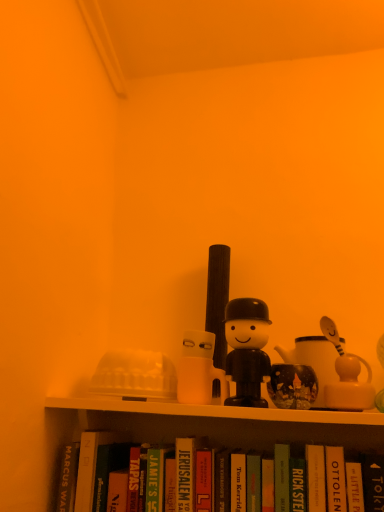
Question: Which direction should I rotate to look at translucent glass mug at center, which ranks as the 2th toy in right-to-left order?

Choices:
 (A) right
 (B) left

Answer: (A)

Question: Which direction should I rotate to look at hardcover book at center, the 7th paperback book positioned from the left, — up or down?

Choices:
 (A) up
 (B) down

Answer: (B)

Question: Is green matte book at lower center, the first paperback book from the left, bigger than hardcover book at center, placed as the third paperback book when sorted from left to right?

Choices:
 (A) no
 (B) yes

Answer: (A)

Question: Does green matte book at lower center, marked as the 7th paperback book in a right-to-left arrangement, turn towards hardcover book at center, acting as the fifth paperback book starting from the right?

Choices:
 (A) no
 (B) yes

Answer: (A)

Question: Is green matte book at lower center, marked as the 7th paperback book in a right-to-left arrangement, not within hardcover book at center, acting as the fifth paperback book starting from the right?

Choices:
 (A) yes
 (B) no

Answer: (A)

Question: Is green matte book at lower center, marked as the 7th paperback book in a right-to-left arrangement, further to the viewer compared to hardcover book at center, placed as the third paperback book when sorted from left to right?

Choices:
 (A) yes
 (B) no

Answer: (A)

Question: Is green matte book at lower center, the first paperback book from the left, positioned far away from hardcover book at center, placed as the third paperback book when sorted from left to right?

Choices:
 (A) yes
 (B) no

Answer: (B)

Question: Is green matte book at lower center, marked as the 7th paperback book in a right-to-left arrangement, at the left side of hardcover book at center, acting as the fifth paperback book starting from the right?

Choices:
 (A) yes
 (B) no

Answer: (A)

Question: From a real-world perspective, is hardcover book at center, arranged as the sixth paperback book when viewed from the right, over hardcover book at center, the 5th paperback book viewed from the left?

Choices:
 (A) no
 (B) yes

Answer: (A)

Question: Is hardcover book at center, arranged as the sixth paperback book when viewed from the right, outside hardcover book at center, the 3th paperback book positioned from the right?

Choices:
 (A) no
 (B) yes

Answer: (B)

Question: Is hardcover book at center, which appears as the 2th paperback book when viewed from the left, oriented away from hardcover book at center, the 5th paperback book viewed from the left?

Choices:
 (A) yes
 (B) no

Answer: (B)

Question: Considering the relative sizes of hardcover book at center, arranged as the sixth paperback book when viewed from the right, and hardcover book at center, the 5th paperback book viewed from the left, in the image provided, is hardcover book at center, arranged as the sixth paperback book when viewed from the right, smaller than hardcover book at center, the 5th paperback book viewed from the left,?

Choices:
 (A) no
 (B) yes

Answer: (A)

Question: Is hardcover book at center, which appears as the 2th paperback book when viewed from the left, at the right side of hardcover book at center, the 5th paperback book viewed from the left?

Choices:
 (A) no
 (B) yes

Answer: (A)

Question: Is hardcover book at center, which appears as the 2th paperback book when viewed from the left, facing towards hardcover book at center, the 3th paperback book positioned from the right?

Choices:
 (A) no
 (B) yes

Answer: (A)

Question: Can you confirm if green matte paperback book at center, placed as the fourth paperback book when sorted from left to right, is taller than white matte mug at center, arranged as the 1th toy when viewed from the left?

Choices:
 (A) no
 (B) yes

Answer: (B)